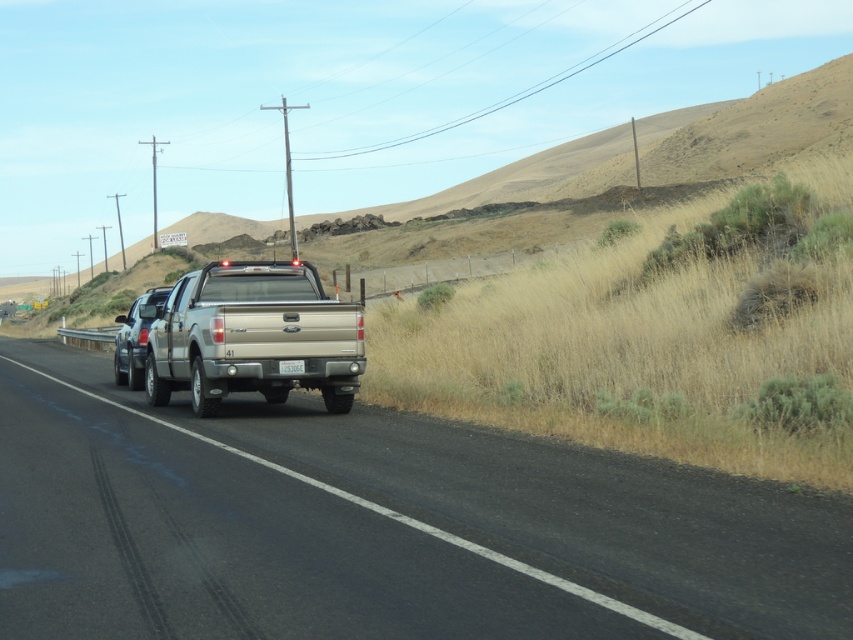
Based on the photo, you are a drone operator trying to capture a photo of the smooth asphalt road at center. What is the exact coordinate where you should focus your camera to ensure the road is centered in the image?

The smooth asphalt road at center is located at point [376,525], so you should focus your camera at those coordinates to center the road in the image.

You are a pedestrian standing on the side of the road. You see the smooth asphalt road at center and the white plastic license plate at rear. Which object is closer to your left side?

The smooth asphalt road at center is to the left of the white plastic license plate at rear, so the smooth asphalt road at center is closer to your left side.

Looking at this image, you are a traffic officer observing a rural road scene. You notice two trucks, the silver metallic truck at center and the satin silver truck at left. Which truck is wider?

The silver metallic truck at center is wider than the satin silver truck at left.